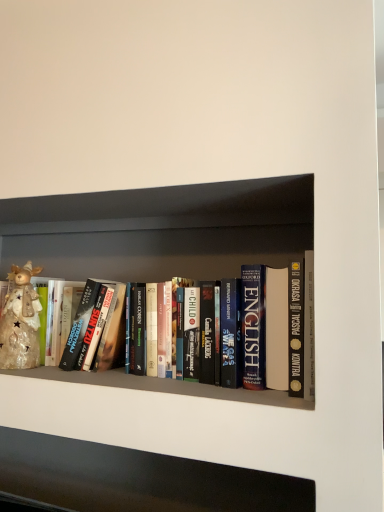
The width and height of the screenshot is (384, 512). Describe the element at coordinates (21, 321) in the screenshot. I see `shiny metallic reindeer at left` at that location.

What are the coordinates of `shiny metallic reindeer at left` in the screenshot? It's located at (21, 321).

The width and height of the screenshot is (384, 512). What do you see at coordinates (159, 268) in the screenshot? I see `hardcover books at center` at bounding box center [159, 268].

Image resolution: width=384 pixels, height=512 pixels. I want to click on hardcover books at center, so click(x=159, y=268).

Measure the distance between hardcover books at center and camera.

hardcover books at center is 26.71 inches from camera.

Find the location of a particular element. The width and height of the screenshot is (384, 512). shiny metallic reindeer at left is located at coordinates (21, 321).

Which object is positioned more to the left, hardcover books at center or shiny metallic reindeer at left?

shiny metallic reindeer at left.

Who is more distant, hardcover books at center or shiny metallic reindeer at left?

shiny metallic reindeer at left is further from the camera.

Does point (208, 257) come farther from viewer compared to point (27, 324)?

Yes, point (208, 257) is farther from viewer.

From the image's perspective, is hardcover books at center above shiny metallic reindeer at left?

Yes, from the image's perspective, hardcover books at center is above shiny metallic reindeer at left.

From a real-world perspective, is hardcover books at center over shiny metallic reindeer at left?

Indeed, from a real-world perspective, hardcover books at center stands above shiny metallic reindeer at left.

Considering the relative sizes of hardcover books at center and shiny metallic reindeer at left in the image provided, is hardcover books at center wider than shiny metallic reindeer at left?

Indeed, hardcover books at center has a greater width compared to shiny metallic reindeer at left.

Considering the sizes of hardcover books at center and shiny metallic reindeer at left in the image, is hardcover books at center taller or shorter than shiny metallic reindeer at left?

hardcover books at center is taller than shiny metallic reindeer at left.

Can you confirm if hardcover books at center is bigger than shiny metallic reindeer at left?

Indeed, hardcover books at center has a larger size compared to shiny metallic reindeer at left.

Choose the correct answer: Is hardcover books at center inside shiny metallic reindeer at left or outside it?

hardcover books at center lies outside shiny metallic reindeer at left.

Is there a large distance between hardcover books at center and shiny metallic reindeer at left?

No, there isn't a large distance between hardcover books at center and shiny metallic reindeer at left.

Is hardcover books at center oriented towards shiny metallic reindeer at left?

Yes, hardcover books at center faces towards shiny metallic reindeer at left.

How many degrees apart are the facing directions of hardcover books at center and shiny metallic reindeer at left?

The angular difference between hardcover books at center and shiny metallic reindeer at left is 0.000494 degrees.

I want to click on toy below the hardcover books at center (from the image's perspective), so click(21, 321).

Can you confirm if shiny metallic reindeer at left is positioned to the right of hardcover books at center?

No, shiny metallic reindeer at left is not to the right of hardcover books at center.

Is the depth of shiny metallic reindeer at left less than that of hardcover books at center?

That is False.

Does point (29, 289) appear closer or farther from the camera than point (153, 266)?

Clearly, point (29, 289) is closer to the camera than point (153, 266).

From the image's perspective, is shiny metallic reindeer at left positioned above or below hardcover books at center?

shiny metallic reindeer at left is below hardcover books at center.

From a real-world perspective, is shiny metallic reindeer at left below hardcover books at center?

Indeed, from a real-world perspective, shiny metallic reindeer at left is positioned beneath hardcover books at center.

In terms of width, does shiny metallic reindeer at left look wider or thinner when compared to hardcover books at center?

Clearly, shiny metallic reindeer at left has less width compared to hardcover books at center.

Can you confirm if shiny metallic reindeer at left is taller than hardcover books at center?

Incorrect, the height of shiny metallic reindeer at left is not larger of that of hardcover books at center.

Considering the sizes of objects shiny metallic reindeer at left and hardcover books at center in the image provided, who is bigger, shiny metallic reindeer at left or hardcover books at center?

hardcover books at center is bigger.

In the scene shown: Is shiny metallic reindeer at left positioned beyond the bounds of hardcover books at center?

No.

Is shiny metallic reindeer at left in contact with hardcover books at center?

shiny metallic reindeer at left and hardcover books at center are not in contact.

Is shiny metallic reindeer at left oriented towards hardcover books at center?

Yes, shiny metallic reindeer at left is oriented towards hardcover books at center.

What's the angular difference between shiny metallic reindeer at left and hardcover books at center's facing directions?

The angular difference between shiny metallic reindeer at left and hardcover books at center is 0.000494 degrees.

This screenshot has width=384, height=512. What are the coordinates of `book above the shiny metallic reindeer at left (from the image's perspective)` in the screenshot? It's located at (159, 268).

The image size is (384, 512). I want to click on toy on the left side of hardcover books at center, so click(x=21, y=321).

This screenshot has width=384, height=512. In order to click on book above the shiny metallic reindeer at left (from the image's perspective) in this screenshot , I will do `click(159, 268)`.